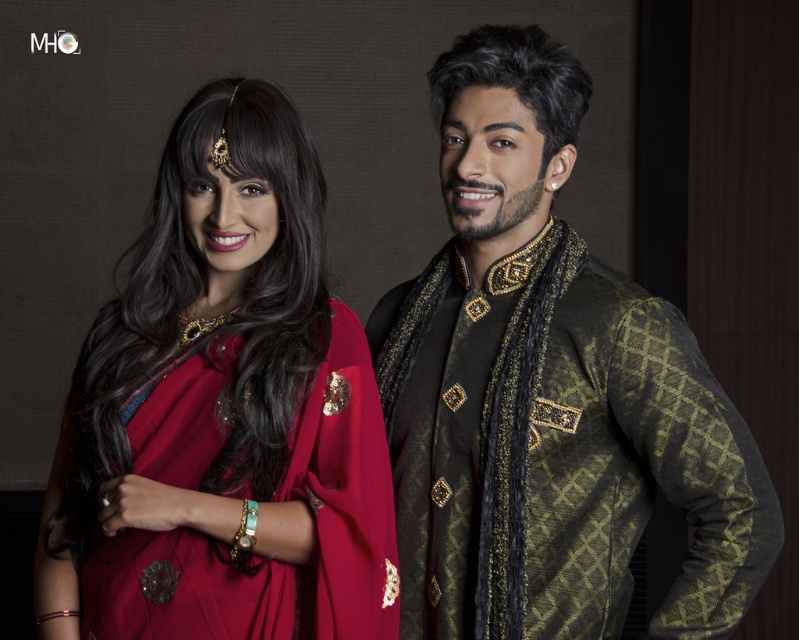
You are a photographer setting up a shoot for a cultural magazine. You need to position a spotlight on the metallic gold and black sherwani at center and the matte red sari at left. Since the spotlight can only illuminate one object at a time, which object should you focus on first if you want to capture the details of the metallic embroidery first?

You should focus the spotlight on the metallic gold and black sherwani at center first because it is to the right of the matte red sari at left, and in photography, it is standard to start with the right side to maintain a natural flow.

What is the 2D coordinate of the metallic gold and black sherwani at center?

The metallic gold and black sherwani at center is located at the coordinate point of (547,392).

You are a photographer setting up for a photoshoot. You need to position a spotlight so that it illuminates both the metallic gold and black sherwani at center and the matte red sari at left without creating harsh shadows. Considering their heights, which garment should be placed closer to the spotlight to ensure even lighting?

The metallic gold and black sherwani at center is taller than the matte red sari at left, so to ensure even lighting, the taller sherwani should be placed closer to the spotlight. This adjustment will help balance the light distribution between both garments, preventing the shorter sari from appearing overly shadowed.